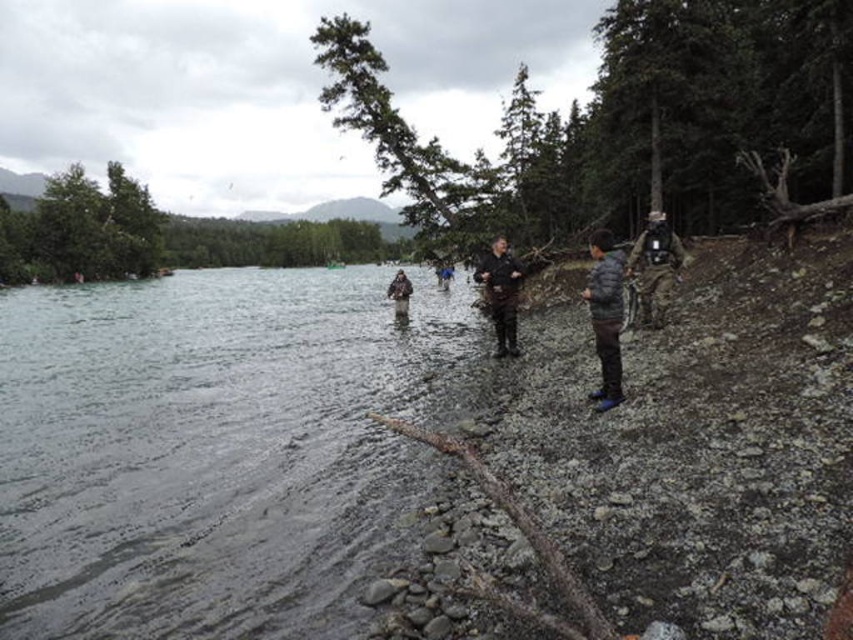
Can you confirm if rough stone shoreline at lower right is smaller than dark brown leather jacket at center?

No.

Can you confirm if rough stone shoreline at lower right is positioned above dark brown leather jacket at center?

No, rough stone shoreline at lower right is not above dark brown leather jacket at center.

The height and width of the screenshot is (640, 853). Describe the element at coordinates (654, 474) in the screenshot. I see `rough stone shoreline at lower right` at that location.

You are a GUI agent. You are given a task and a screenshot of the screen. Output one action in this format:
    pyautogui.click(x=<x>, y=<y>)
    Task: Click on the rough stone shoreline at lower right
    Image resolution: width=853 pixels, height=640 pixels.
    Given the screenshot: What is the action you would take?
    pyautogui.click(x=654, y=474)

Does point (793, 456) come in front of point (404, 282)?

Yes, point (793, 456) is closer to viewer.

Consider the image. Can you confirm if rough stone shoreline at lower right is bigger than camouflage jacket at center?

Yes.

Locate an element on the screen. The height and width of the screenshot is (640, 853). rough stone shoreline at lower right is located at coordinates (654, 474).

Is point (848, 538) closer to viewer compared to point (445, 273)?

Yes, point (848, 538) is in front of point (445, 273).

Who is taller, rough stone shoreline at lower right or dark gray jacket at center?

Standing taller between the two is rough stone shoreline at lower right.

I want to click on rough stone shoreline at lower right, so click(x=654, y=474).